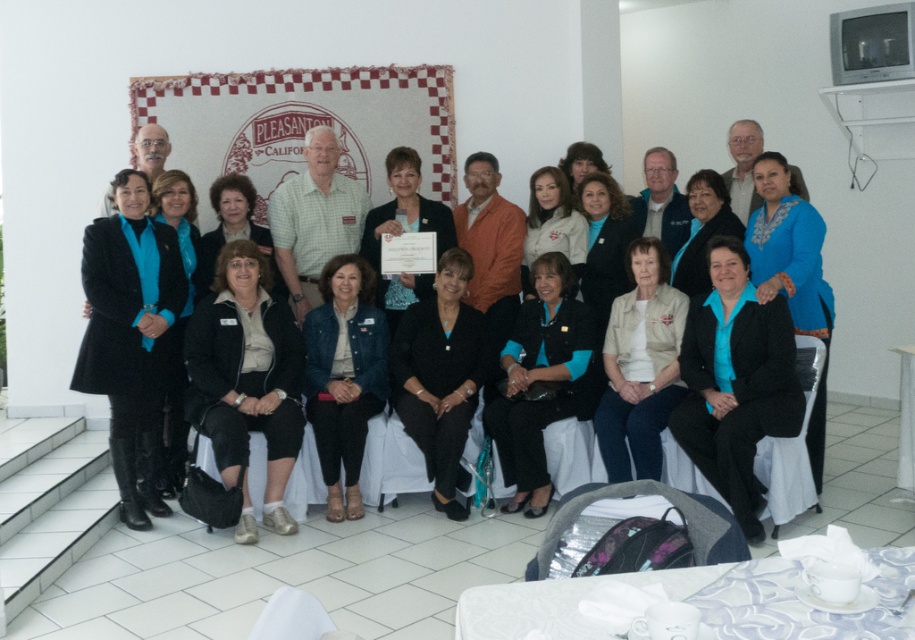
Does point (427, 426) come farther from viewer compared to point (341, 513)?

No, (427, 426) is in front of (341, 513).

Consider the image. Is black textured blazer at center shorter than denim jacket at center?

Incorrect, black textured blazer at center's height does not fall short of denim jacket at center's.

Does point (471, 328) lie behind point (325, 513)?

That is True.

Identify the location of black textured blazer at center. (440, 374).

Is teal fabric jacket at center wider than denim jacket at center?

Yes, teal fabric jacket at center is wider than denim jacket at center.

Locate an element on the screen. The image size is (915, 640). teal fabric jacket at center is located at coordinates (539, 380).

Between white porcelain cup at lower right and denim jacket at center, which one is positioned higher?

denim jacket at center is higher up.

Who is positioned more to the right, white porcelain cup at lower right or denim jacket at center?

white porcelain cup at lower right is more to the right.

Which is behind, point (770, 604) or point (374, 362)?

Positioned behind is point (374, 362).

Find the location of a particular element. This screenshot has height=640, width=915. white porcelain cup at lower right is located at coordinates (697, 602).